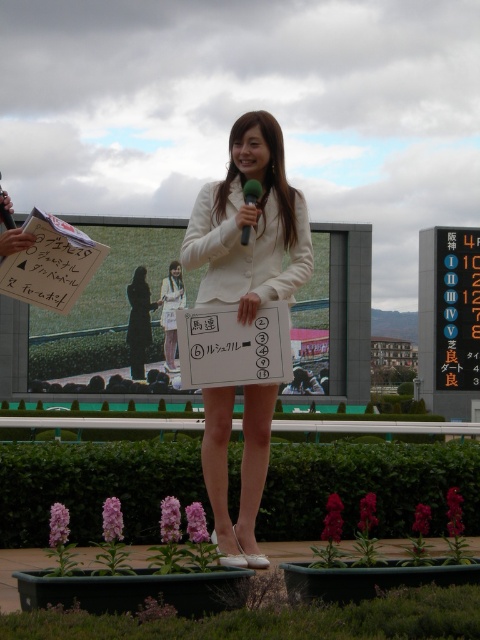
You are a photographer at the racecourse and need to capture a clear shot of both the white fabric dress at center and the metallic silver microphone at center. Since the dress is taller than the microphone, where should you position your camera to ensure both are fully visible in the frame?

Since the white fabric dress at center is taller than the metallic silver microphone at center, position the camera at a lower angle to capture the full height of the dress while keeping the microphone in view.

You are a photographer positioned at the front of the stage. You need to capture a photo that includes both the white matte blazer at center and the metallic silver microphone at center. The minimum distance between the two objects in the photo must be at least 30 inches to ensure clarity. Based on their current positions, will you be able to achieve this?

The white matte blazer at center is 28.51 inches away from the metallic silver microphone at center. Since 28.51 inches is less than the required 30 inches, the photographer will not be able to achieve the minimum distance requirement in the photo.

Where is the white paper at center located in the image?

The white paper at center is located at the 2D coordinates point (233, 346).